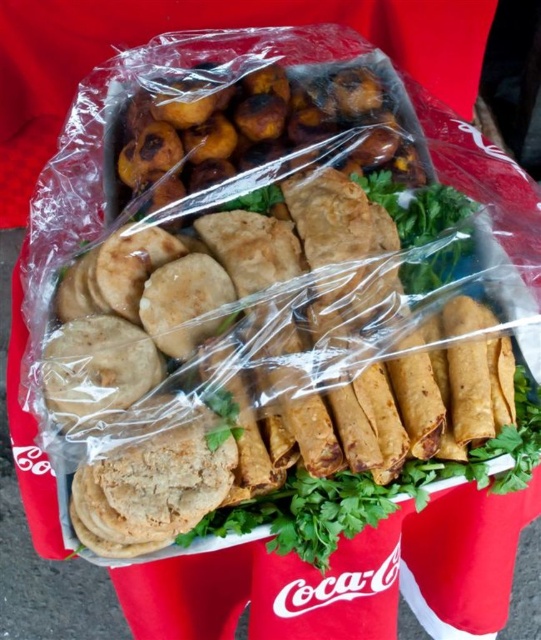
Is brown crispy taquitos at center thinner than golden-brown crispy fried balls at upper center?

No, brown crispy taquitos at center is not thinner than golden-brown crispy fried balls at upper center.

Between brown crispy taquitos at center and golden-brown crispy fried balls at upper center, which one is positioned higher?

golden-brown crispy fried balls at upper center is higher up.

I want to click on brown crispy taquitos at center, so click(x=272, y=320).

What are the coordinates of `brown crispy taquitos at center` in the screenshot? It's located at (272, 320).